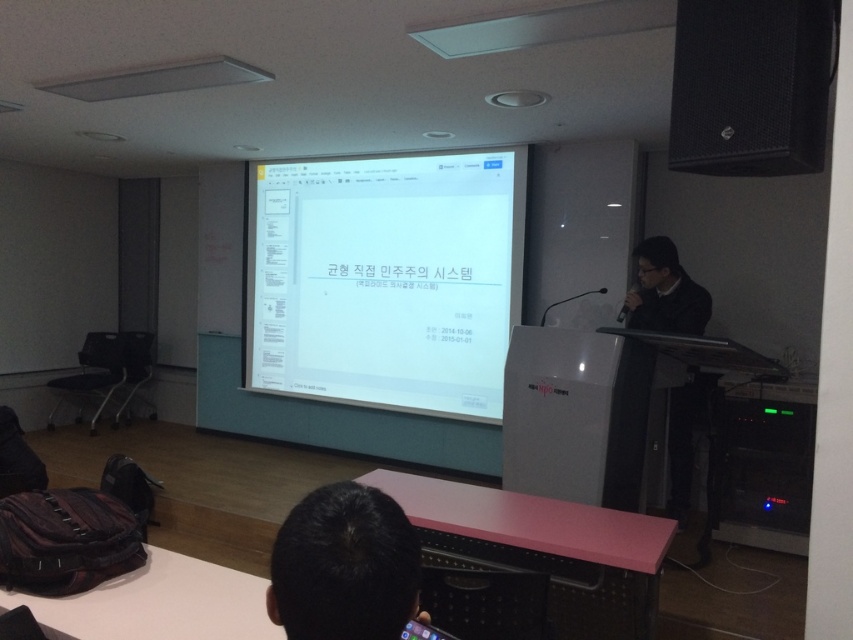
Question: Which point is farther to the camera?

Choices:
 (A) (498, 364)
 (B) (788, 64)
 (C) (665, 326)
 (D) (401, 509)

Answer: (A)

Question: Which is nearer to the black hair at lower center?

Choices:
 (A) black matte speaker at upper right
 (B) white paper at center
 (C) black matte suit at right

Answer: (A)

Question: Which of the following is the farthest from the observer?

Choices:
 (A) black hair at lower center
 (B) black matte speaker at upper right

Answer: (B)

Question: Where is white paper at center located in relation to black matte speaker at upper right in the image?

Choices:
 (A) above
 (B) below

Answer: (B)

Question: Can you confirm if white paper at center is smaller than black matte speaker at upper right?

Choices:
 (A) no
 (B) yes

Answer: (A)

Question: Is white paper at center to the right of black hair at lower center from the viewer's perspective?

Choices:
 (A) no
 (B) yes

Answer: (A)